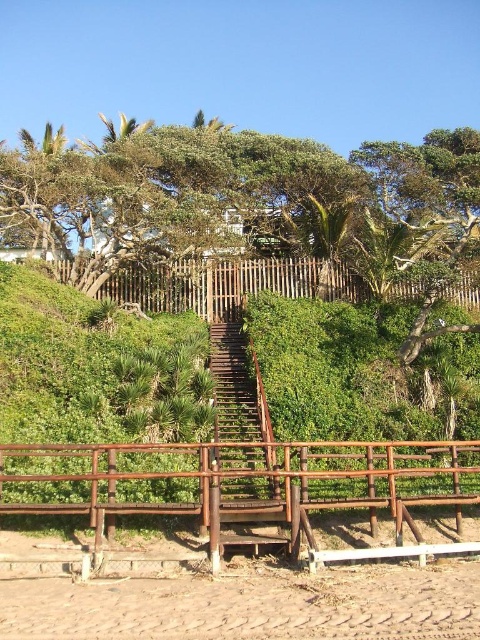
Question: Which point is farther from the camera taking this photo?

Choices:
 (A) (278, 579)
 (B) (15, 468)
 (C) (276, 480)
 (D) (113, 141)

Answer: (D)

Question: Is brown textured sand at lower center below rusty metal stairs at center?

Choices:
 (A) no
 (B) yes

Answer: (B)

Question: Is rustic wood railing at center closer to camera compared to rusty metal stairs at center?

Choices:
 (A) no
 (B) yes

Answer: (B)

Question: Which of these objects is positioned farthest from the green leafy tree at upper center?

Choices:
 (A) rustic wood railing at center
 (B) rusty metal stairs at center
 (C) brown textured sand at lower center

Answer: (B)

Question: Does green leafy tree at upper center come behind rusty metal stairs at center?

Choices:
 (A) yes
 (B) no

Answer: (A)

Question: Which object is the closest to the rusty metal stairs at center?

Choices:
 (A) brown textured sand at lower center
 (B) green leafy tree at upper center
 (C) rustic wood railing at center

Answer: (C)